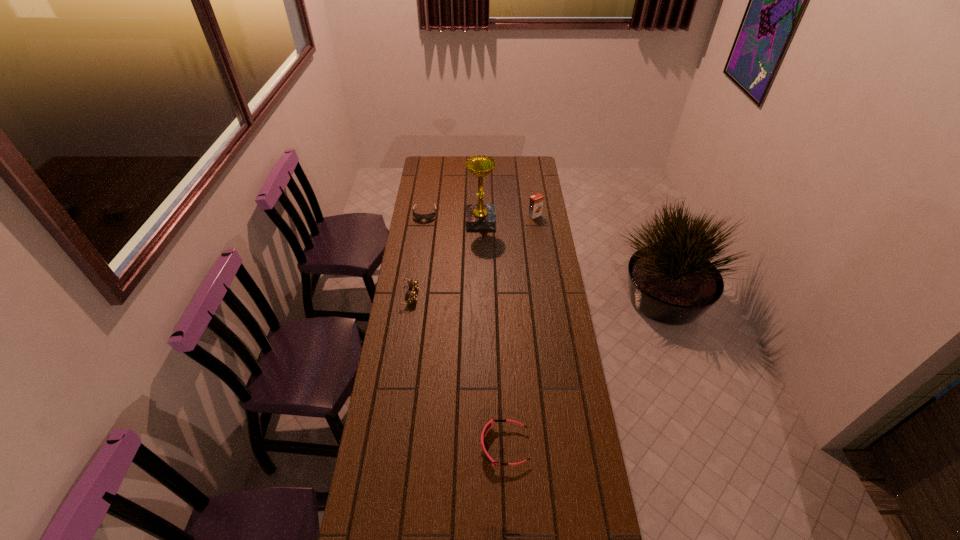
Locate an element on the screen. The width and height of the screenshot is (960, 540). blank space located on the front-facing side of the tallest object is located at coordinates (434, 220).

I want to click on free location located on the left of the orange juice, so (x=506, y=215).

Locate an element on the screen. The height and width of the screenshot is (540, 960). vacant space located 0.310m through the lenses of the fourth farthest object is located at coordinates (490, 295).

You are a GUI agent. You are given a task and a screenshot of the screen. Output one action in this format:
    pyautogui.click(x=<x>, y=<y>)
    Task: Click on the free point located 0.320m on the front-facing side of the rightmost goggles
    The height and width of the screenshot is (540, 960).
    Given the screenshot: What is the action you would take?
    pyautogui.click(x=383, y=446)

I want to click on vacant region located 0.240m on the front-facing side of the rightmost goggles, so click(407, 446).

Where is `free space located on the front-facing side of the rightmost goggles`? free space located on the front-facing side of the rightmost goggles is located at coordinates 441,446.

This screenshot has width=960, height=540. In order to click on vacant space located 0.200m on the front and sides of the shortest object in this screenshot , I will do `click(420, 247)`.

This screenshot has height=540, width=960. Identify the location of object that is at the right edge. (536, 201).

The height and width of the screenshot is (540, 960). In the image, there is a desktop. Identify the location of free space at the far edge. (498, 160).

Image resolution: width=960 pixels, height=540 pixels. I want to click on vacant region at the left edge of the desktop, so click(x=443, y=215).